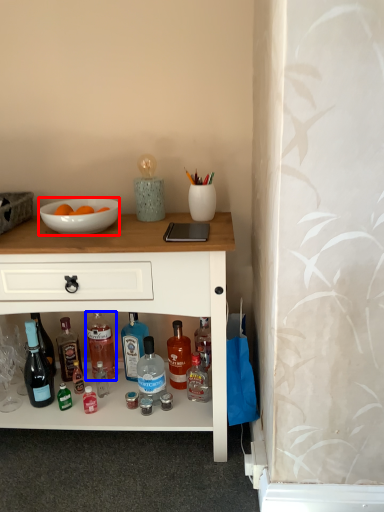
Question: Which point is further to the camera, bowl (highlighted by a red box) or bottle (highlighted by a blue box)?

Choices:
 (A) bowl
 (B) bottle

Answer: (B)